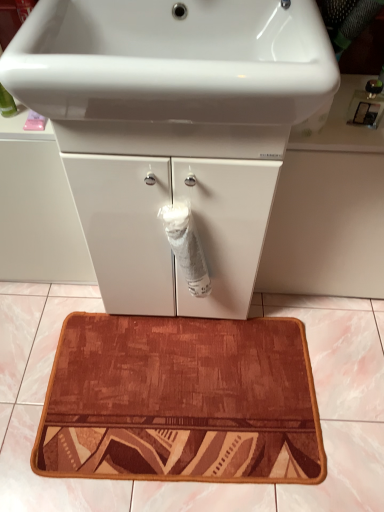
What do you see at coordinates (172, 74) in the screenshot? This screenshot has height=512, width=384. I see `white glossy sink at upper center` at bounding box center [172, 74].

What is the approximate width of white glossy cabinet at center?

white glossy cabinet at center is 18.09 inches wide.

This screenshot has height=512, width=384. What do you see at coordinates (186, 247) in the screenshot?
I see `white matte toilet paper at center` at bounding box center [186, 247].

Locate an element on the screen. The height and width of the screenshot is (512, 384). white glossy sink at upper center is located at coordinates (172, 74).

Is white glossy cabinet at center turned away from white matte toilet paper at center?

Yes, white glossy cabinet at center is positioned with its back facing white matte toilet paper at center.

Where is `bathroom cabinet below the white matte toilet paper at center (from a real-world perspective)`? The height and width of the screenshot is (512, 384). bathroom cabinet below the white matte toilet paper at center (from a real-world perspective) is located at coordinates (172, 130).

From the image's perspective, which one is positioned lower, white glossy cabinet at center or white matte toilet paper at center?

white matte toilet paper at center.

In terms of height, does white glossy cabinet at center look taller or shorter compared to white matte toilet paper at center?

Considering their sizes, white glossy cabinet at center has more height than white matte toilet paper at center.

Does white glossy sink at upper center lie in front of white matte toilet paper at center?

Yes.

Is white glossy sink at upper center bigger or smaller than white matte toilet paper at center?

Clearly, white glossy sink at upper center is larger in size than white matte toilet paper at center.

Can white matte toilet paper at center be found inside white glossy sink at upper center?

No, white matte toilet paper at center is not a part of white glossy sink at upper center.

From a real-world perspective, relative to white matte toilet paper at center, is white glossy sink at upper center vertically above or below?

Clearly, from a real-world perspective, white glossy sink at upper center is above white matte toilet paper at center.

Is white glossy sink at upper center at the back of white matte toilet paper at center?

No, white matte toilet paper at center is not facing away from white glossy sink at upper center.

Considering the sizes of objects white matte toilet paper at center and white glossy sink at upper center in the image provided, who is bigger, white matte toilet paper at center or white glossy sink at upper center?

Bigger between the two is white glossy sink at upper center.

Does point (180, 255) lie in front of point (164, 41)?

No, (180, 255) is further to viewer.

From the image's perspective, which is above, white matte toilet paper at center or white glossy sink at upper center?

white glossy sink at upper center, from the image's perspective.

Can we say white glossy sink at upper center lies outside brown textured bath mat at center?

white glossy sink at upper center lies outside brown textured bath mat at center's area.

Which of these two, white glossy sink at upper center or brown textured bath mat at center, is thinner?

Thinner between the two is white glossy sink at upper center.

From a real-world perspective, is white glossy sink at upper center physically above brown textured bath mat at center?

Yes, from a real-world perspective, white glossy sink at upper center is on top of brown textured bath mat at center.

From the image's perspective, is white glossy sink at upper center above or below brown textured bath mat at center?

white glossy sink at upper center is situated higher than brown textured bath mat at center in the image.

How many degrees apart are the facing directions of brown textured bath mat at center and white glossy cabinet at center?

The angle between the facing direction of brown textured bath mat at center and the facing direction of white glossy cabinet at center is 90.3 degrees.

Is brown textured bath mat at center positioned beyond the bounds of white glossy cabinet at center?

brown textured bath mat at center is positioned outside white glossy cabinet at center.

Which of these two, brown textured bath mat at center or white glossy cabinet at center, stands taller?

white glossy cabinet at center.

From the image's perspective, which object appears higher, brown textured bath mat at center or white glossy cabinet at center?

white glossy cabinet at center.

Which is less distant, (13, 87) or (154, 157)?

Point (13, 87) is positioned closer to the camera compared to point (154, 157).

Is white glossy cabinet at center surrounded by white glossy sink at upper center?

No.

Considering the positions of objects white glossy sink at upper center and white glossy cabinet at center in the image provided, who is in front, white glossy sink at upper center or white glossy cabinet at center?

white glossy sink at upper center is closer to the camera.

Find the location of a particular element. This screenshot has width=384, height=512. sink that is in front of the white glossy cabinet at center is located at coordinates (172, 74).

Based on the photo, from the image's perspective, is white glossy cabinet at center located above or below brown textured bath mat at center?

white glossy cabinet at center is situated higher than brown textured bath mat at center in the image.

Is white glossy cabinet at center next to brown textured bath mat at center and touching it?

white glossy cabinet at center and brown textured bath mat at center are not in contact.

From a real-world perspective, between white glossy cabinet at center and brown textured bath mat at center, who is vertically lower?

brown textured bath mat at center is physically lower.

Could you tell me if white glossy cabinet at center is facing brown textured bath mat at center?

Yes, white glossy cabinet at center is turned towards brown textured bath mat at center.

The height and width of the screenshot is (512, 384). Find the location of `toilet paper above the white glossy cabinet at center (from a real-world perspective)`. toilet paper above the white glossy cabinet at center (from a real-world perspective) is located at coordinates (186, 247).

Identify the location of toilet paper that appears on the right of white glossy sink at upper center. (186, 247).

Based on their spatial positions, is white glossy sink at upper center or white glossy cabinet at center closer to white matte toilet paper at center?

white glossy cabinet at center.

Estimate the real-world distances between objects in this image. Which object is further from white glossy cabinet at center, brown textured bath mat at center or white matte toilet paper at center?

brown textured bath mat at center is positioned further to the anchor white glossy cabinet at center.

Looking at the image, which one is located closer to white glossy sink at upper center, brown textured bath mat at center or white matte toilet paper at center?

white matte toilet paper at center is positioned closer to the anchor white glossy sink at upper center.

From the image, which object appears to be farther from brown textured bath mat at center, white glossy cabinet at center or white matte toilet paper at center?

white glossy cabinet at center.

Looking at the image, which one is located further to white glossy cabinet at center, white glossy sink at upper center or brown textured bath mat at center?

brown textured bath mat at center.

From the image, which object appears to be farther from white matte toilet paper at center, brown textured bath mat at center or white glossy sink at upper center?

Based on the image, brown textured bath mat at center appears to be further to white matte toilet paper at center.

Based on their spatial positions, is white matte toilet paper at center or white glossy sink at upper center closer to brown textured bath mat at center?

white matte toilet paper at center lies closer to brown textured bath mat at center than the other object.

From the image, which object appears to be farther from white matte toilet paper at center, brown textured bath mat at center or white glossy cabinet at center?

The object further to white matte toilet paper at center is brown textured bath mat at center.

At what (x,y) coordinates should I click in order to perform the action: click on toilet paper between white glossy sink at upper center and brown textured bath mat at center vertically. Please return your answer as a coordinate pair (x, y). The image size is (384, 512). Looking at the image, I should click on (186, 247).

You are a GUI agent. You are given a task and a screenshot of the screen. Output one action in this format:
    pyautogui.click(x=<x>, y=<y>)
    Task: Click on the bathroom cabinet between white glossy sink at upper center and white matte toilet paper at center from top to bottom
    This screenshot has width=384, height=512.
    Given the screenshot: What is the action you would take?
    pyautogui.click(x=172, y=130)

The width and height of the screenshot is (384, 512). I want to click on bathroom cabinet that lies between white glossy sink at upper center and brown textured bath mat at center from top to bottom, so click(x=172, y=130).

Where is `toilet paper between white glossy cabinet at center and brown textured bath mat at center vertically`? toilet paper between white glossy cabinet at center and brown textured bath mat at center vertically is located at coordinates (186, 247).